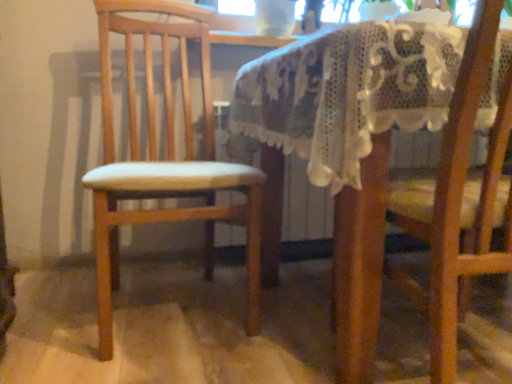
The image size is (512, 384). What do you see at coordinates (429, 220) in the screenshot?
I see `wooden chair at right, the 1th chair viewed from the right` at bounding box center [429, 220].

What is the approximate width of wooden chair at right, the 1th chair viewed from the right?

It is 21.76 inches.

Where is `wooden chair at right, which appears as the 2th chair when viewed from the left`? wooden chair at right, which appears as the 2th chair when viewed from the left is located at coordinates (429, 220).

In order to face wooden chair at right, the 1th chair viewed from the right, should I rotate leftwards or rightwards?

You should look right and rotate roughly 26.536 degrees.

Describe the element at coordinates (167, 157) in the screenshot. I see `wooden chair at left, the 1th chair from the left` at that location.

Image resolution: width=512 pixels, height=384 pixels. I want to click on wooden chair at left, the 1th chair from the left, so click(x=167, y=157).

Locate an element on the screen. This screenshot has height=384, width=512. wooden chair at right, which appears as the 2th chair when viewed from the left is located at coordinates (429, 220).

Is wooden chair at left, the 1th chair from the left, at the right side of wooden chair at right, which appears as the 2th chair when viewed from the left?

In fact, wooden chair at left, the 1th chair from the left, is to the left of wooden chair at right, which appears as the 2th chair when viewed from the left.

Considering their positions, is wooden chair at left, the 1th chair from the left, located in front of or behind wooden chair at right, the 1th chair viewed from the right?

wooden chair at left, the 1th chair from the left, is positioned farther from the viewer than wooden chair at right, the 1th chair viewed from the right.

Between point (191, 167) and point (336, 304), which one is positioned in front?

The point (336, 304) is in front.

From the image's perspective, which is below, wooden chair at left, the 1th chair from the left, or wooden chair at right, the 1th chair viewed from the right?

From the image's view, wooden chair at right, the 1th chair viewed from the right, is below.

From a real-world perspective, between wooden chair at left, arranged as the 2th chair when viewed from the right, and wooden chair at right, which appears as the 2th chair when viewed from the left, who is vertically lower?

In real-world perspective, wooden chair at right, which appears as the 2th chair when viewed from the left, is lower.

In the scene shown: Does wooden chair at left, arranged as the 2th chair when viewed from the right, have a greater width compared to wooden chair at right, the 1th chair viewed from the right?

Indeed, wooden chair at left, arranged as the 2th chair when viewed from the right, has a greater width compared to wooden chair at right, the 1th chair viewed from the right.

Is wooden chair at left, arranged as the 2th chair when viewed from the right, shorter than wooden chair at right, the 1th chair viewed from the right?

No, wooden chair at left, arranged as the 2th chair when viewed from the right, is not shorter than wooden chair at right, the 1th chair viewed from the right.

Between wooden chair at left, arranged as the 2th chair when viewed from the right, and wooden chair at right, the 1th chair viewed from the right, which one has smaller size?

With smaller size is wooden chair at right, the 1th chair viewed from the right.

Can we say wooden chair at left, the 1th chair from the left, lies outside wooden chair at right, the 1th chair viewed from the right?

Yes.

Is wooden chair at left, arranged as the 2th chair when viewed from the right, far away from wooden chair at right, which appears as the 2th chair when viewed from the left?

Actually, wooden chair at left, arranged as the 2th chair when viewed from the right, and wooden chair at right, which appears as the 2th chair when viewed from the left, are a little close together.

Could you tell me if wooden chair at left, arranged as the 2th chair when viewed from the right, is turned towards wooden chair at right, the 1th chair viewed from the right?

No.

Where is `chair on the right side of wooden chair at left, the 1th chair from the left`? The image size is (512, 384). chair on the right side of wooden chair at left, the 1th chair from the left is located at coordinates (429, 220).

Is wooden chair at right, which appears as the 2th chair when viewed from the left, at the right side of wooden chair at left, the 1th chair from the left?

Yes, wooden chair at right, which appears as the 2th chair when viewed from the left, is to the right of wooden chair at left, the 1th chair from the left.

Which is in front, wooden chair at right, the 1th chair viewed from the right, or wooden chair at left, the 1th chair from the left?

wooden chair at right, the 1th chair viewed from the right, is in front.

Which is nearer, (461,115) or (106,87)?

Point (461,115)

From the image's perspective, between wooden chair at right, the 1th chair viewed from the right, and wooden chair at left, arranged as the 2th chair when viewed from the right, who is located below?

wooden chair at right, the 1th chair viewed from the right, is shown below in the image.

From a real-world perspective, which object rests below the other?

A: From a 3D spatial view, wooden chair at right, which appears as the 2th chair when viewed from the left, is below.

Which object is thinner, wooden chair at right, the 1th chair viewed from the right, or wooden chair at left, arranged as the 2th chair when viewed from the right?

wooden chair at right, the 1th chair viewed from the right.

Who is taller, wooden chair at right, the 1th chair viewed from the right, or wooden chair at left, arranged as the 2th chair when viewed from the right?

Standing taller between the two is wooden chair at left, arranged as the 2th chair when viewed from the right.

Does wooden chair at right, which appears as the 2th chair when viewed from the left, have a larger size compared to wooden chair at left, arranged as the 2th chair when viewed from the right?

No, wooden chair at right, which appears as the 2th chair when viewed from the left, is not bigger than wooden chair at left, arranged as the 2th chair when viewed from the right.

Would you say wooden chair at right, the 1th chair viewed from the right, is inside or outside wooden chair at left, arranged as the 2th chair when viewed from the right?

wooden chair at right, the 1th chair viewed from the right, is spatially situated outside wooden chair at left, arranged as the 2th chair when viewed from the right.

Are wooden chair at right, which appears as the 2th chair when viewed from the left, and wooden chair at left, the 1th chair from the left, beside each other?

wooden chair at right, which appears as the 2th chair when viewed from the left, and wooden chair at left, the 1th chair from the left, are clearly separated.

Is wooden chair at right, which appears as the 2th chair when viewed from the left, positioned with its back to wooden chair at left, arranged as the 2th chair when viewed from the right?

No, wooden chair at right, which appears as the 2th chair when viewed from the left, is not facing away from wooden chair at left, arranged as the 2th chair when viewed from the right.

How different are the orientations of wooden chair at right, the 1th chair viewed from the right, and wooden chair at left, arranged as the 2th chair when viewed from the right, in degrees?

They differ by 172 degrees in their facing directions.

Could you measure the distance between wooden chair at right, the 1th chair viewed from the right, and wooden chair at left, the 1th chair from the left?

wooden chair at right, the 1th chair viewed from the right, is 52.88 centimeters from wooden chair at left, the 1th chair from the left.

Image resolution: width=512 pixels, height=384 pixels. In order to click on chair lying below the wooden chair at left, arranged as the 2th chair when viewed from the right (from the image's perspective) in this screenshot , I will do `click(429, 220)`.

Locate an element on the screen. This screenshot has width=512, height=384. chair in front of the wooden chair at left, arranged as the 2th chair when viewed from the right is located at coordinates (429, 220).

Locate an element on the screen. chair behind the wooden chair at right, which appears as the 2th chair when viewed from the left is located at coordinates (167, 157).